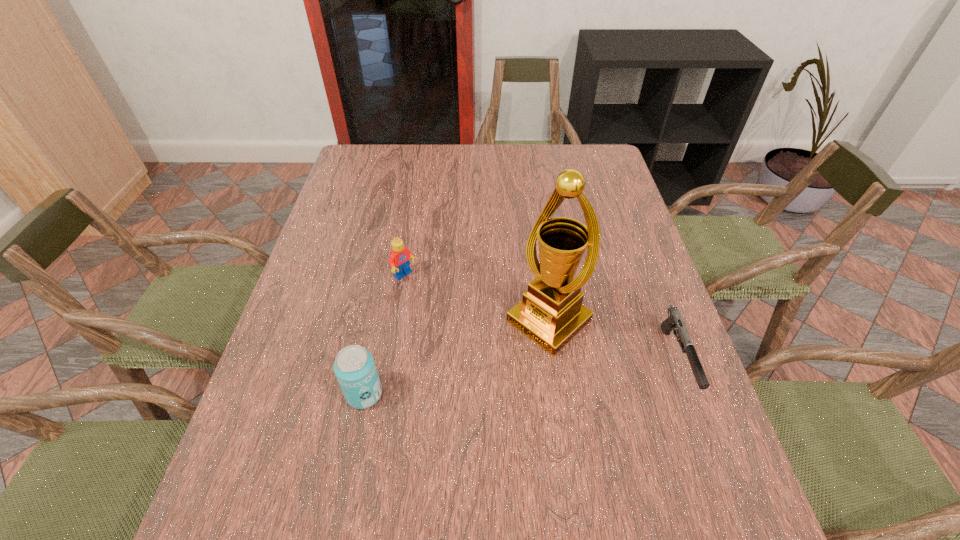
Identify the location of free region at the near left corner. This screenshot has width=960, height=540. (277, 459).

Find the location of a particular element. blank area at the far right corner is located at coordinates [x=604, y=146].

Identify the location of free space at the near right corner of the desktop. pyautogui.click(x=703, y=443).

The image size is (960, 540). Find the location of `free space between the tallest object and the farthest object`. free space between the tallest object and the farthest object is located at coordinates (477, 299).

What are the coordinates of `free spot between the gun and the beer can` in the screenshot? It's located at (520, 377).

Locate an element on the screen. This screenshot has height=540, width=960. free spot between the tallest object and the beer can is located at coordinates (457, 357).

Where is `empty location between the beer can and the shortest object`? This screenshot has width=960, height=540. empty location between the beer can and the shortest object is located at coordinates (520, 377).

Find the location of a particular element. The width and height of the screenshot is (960, 540). vacant space in between the farthest object and the beer can is located at coordinates (385, 335).

The width and height of the screenshot is (960, 540). I want to click on vacant space that is in between the gun and the award, so click(612, 340).

Identify the location of blank region between the gun and the beer can. Image resolution: width=960 pixels, height=540 pixels. coord(520,377).